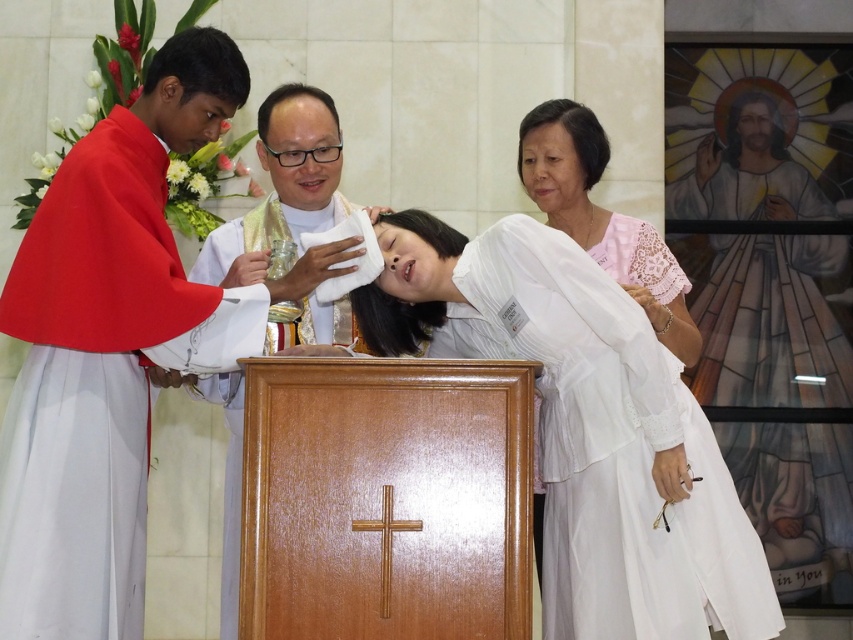
Question: Does white lace robe at upper right have a lesser width compared to white silk cloth at center?

Choices:
 (A) yes
 (B) no

Answer: (B)

Question: Among these objects, which one is nearest to the camera?

Choices:
 (A) matte red robe at left
 (B) white lace robe at upper right
 (C) white lace dress at right

Answer: (A)

Question: Does white lace robe at center have a greater width compared to white silk cloth at center?

Choices:
 (A) yes
 (B) no

Answer: (A)

Question: Is matte red robe at left further to the viewer compared to white lace robe at upper right?

Choices:
 (A) yes
 (B) no

Answer: (B)

Question: Considering the real-world distances, which object is closest to the white silk cloth at center?

Choices:
 (A) matte red robe at left
 (B) white lace robe at upper right
 (C) white lace robe at center

Answer: (A)

Question: Based on their relative distances, which object is nearer to the white lace robe at center?

Choices:
 (A) white lace robe at upper right
 (B) white silk cloth at center

Answer: (B)